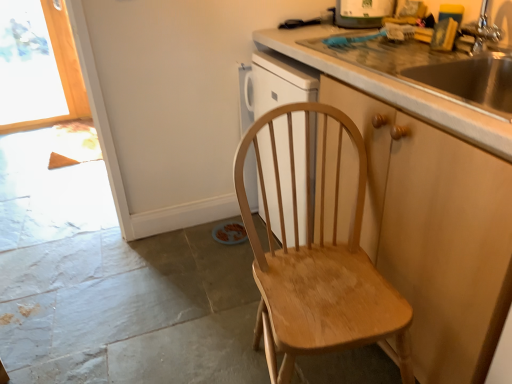
Question: From a real-world perspective, is white glossy dishwasher at upper center below light brown wooden chair at center?

Choices:
 (A) no
 (B) yes

Answer: (A)

Question: From the image's perspective, would you say white glossy dishwasher at upper center is shown under light brown wooden chair at center?

Choices:
 (A) yes
 (B) no

Answer: (B)

Question: Considering the relative sizes of white glossy dishwasher at upper center and light brown wooden chair at center in the image provided, is white glossy dishwasher at upper center wider than light brown wooden chair at center?

Choices:
 (A) no
 (B) yes

Answer: (A)

Question: Can you confirm if white glossy dishwasher at upper center is taller than light brown wooden chair at center?

Choices:
 (A) yes
 (B) no

Answer: (B)

Question: Can you confirm if white glossy dishwasher at upper center is shorter than light brown wooden chair at center?

Choices:
 (A) yes
 (B) no

Answer: (A)

Question: Is white glossy dishwasher at upper center turned away from light brown wooden chair at center?

Choices:
 (A) no
 (B) yes

Answer: (A)

Question: Would you say white glossy dishwasher at upper center contains transparent glass window at upper left?

Choices:
 (A) yes
 (B) no

Answer: (B)

Question: Could you tell me if white glossy dishwasher at upper center is turned towards transparent glass window at upper left?

Choices:
 (A) yes
 (B) no

Answer: (B)

Question: Is white glossy dishwasher at upper center closer to the viewer compared to transparent glass window at upper left?

Choices:
 (A) no
 (B) yes

Answer: (B)

Question: Is white glossy dishwasher at upper center next to transparent glass window at upper left and touching it?

Choices:
 (A) no
 (B) yes

Answer: (A)

Question: Would you consider white glossy dishwasher at upper center to be distant from transparent glass window at upper left?

Choices:
 (A) yes
 (B) no

Answer: (A)

Question: Can you confirm if white glossy dishwasher at upper center is smaller than transparent glass window at upper left?

Choices:
 (A) no
 (B) yes

Answer: (B)

Question: Is white glossy dishwasher at upper center placed right next to wooden cabinet at right?

Choices:
 (A) no
 (B) yes

Answer: (A)